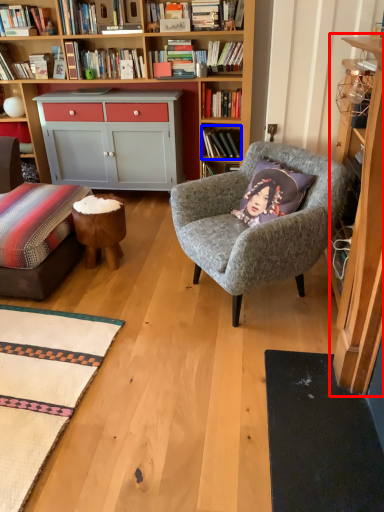
Question: Among these objects, which one is farthest to the camera, cabinet (highlighted by a red box) or book (highlighted by a blue box)?

Choices:
 (A) cabinet
 (B) book

Answer: (B)